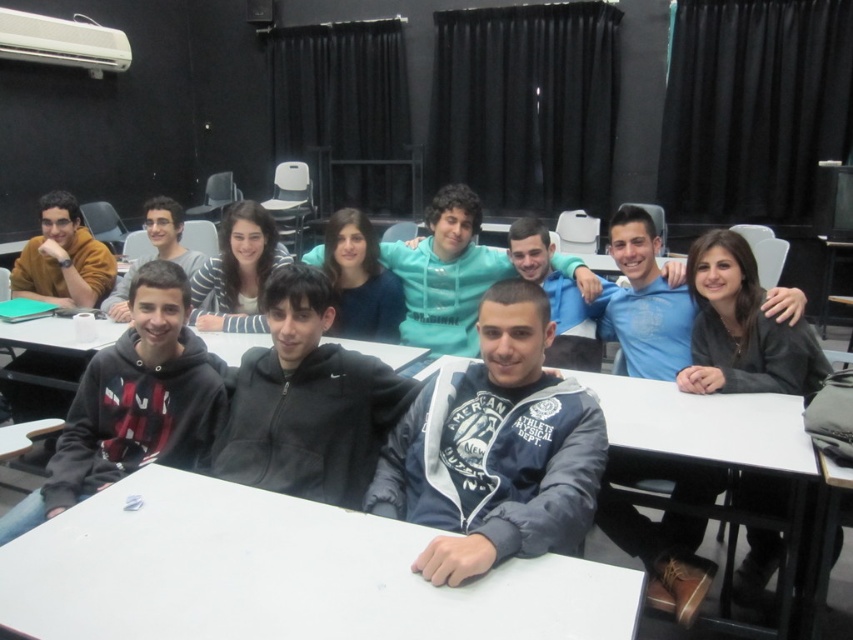
You are organizing a classroom activity and need to place a dark gray sweater at center on a white matte table at center. Can the sweater fit on the table without hanging over the edges?

The white matte table at center is wider than the dark gray sweater at center, so the sweater can fit on the table without hanging over the edges.

You are a photographer setting up for a group photo in the classroom. You notice the blue fabric jacket at center and the striped fabric shirt at center. Which clothing item should you adjust to ensure both are fully visible in the photo?

The blue fabric jacket at center is much taller than the striped fabric shirt at center, so you should adjust the blue fabric jacket at center to avoid blocking the striped fabric shirt at center.

You are organizing a small event in this classroom and need to place a rectangular banner that is 1 meter wide on either the white matte table at center or the black fleece hoodie at left. Based on their widths, which object can the banner fit on without overhanging?

The white matte table at center has a greater width than the black fleece hoodie at left, so the banner can fit on the white matte table at center without overhanging.